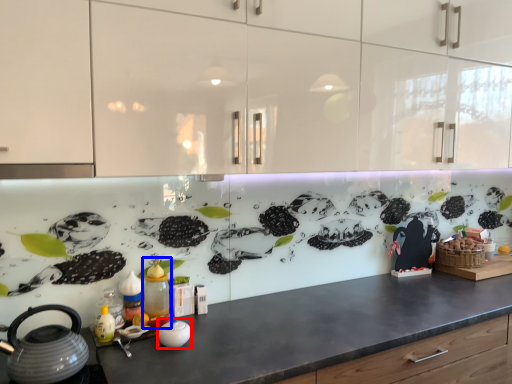
Question: Which object is further to the camera taking this photo, appliance (highlighted by a red box) or bottle (highlighted by a blue box)?

Choices:
 (A) appliance
 (B) bottle

Answer: (B)